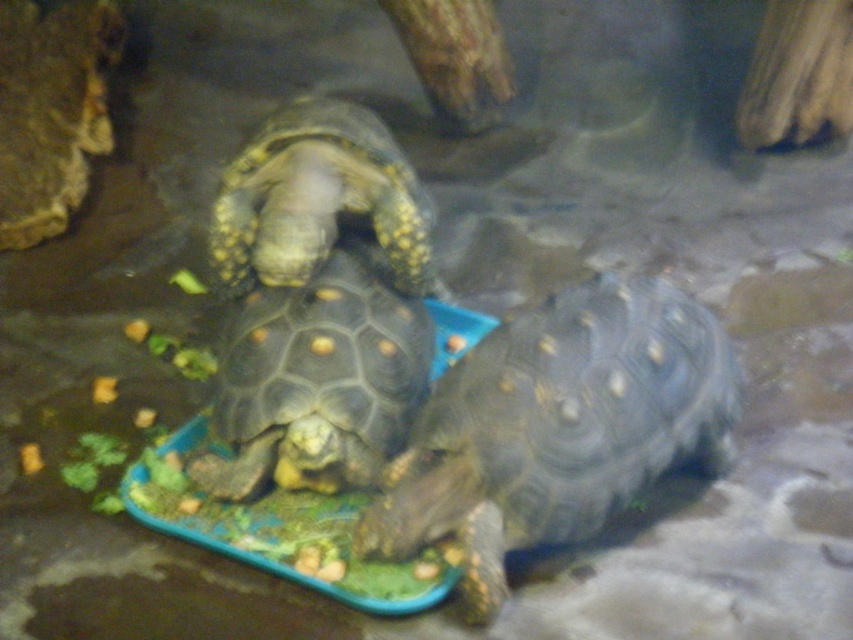
Question: Which is farther from the dark gray textured shell at center?

Choices:
 (A) yellowish matte tortoise at center
 (B) yellowish-brown scaly shell at center

Answer: (B)

Question: Where is dark gray textured shell at center located in relation to yellowish matte tortoise at center in the image?

Choices:
 (A) left
 (B) right

Answer: (B)

Question: Based on their relative distances, which object is farther from the dark gray textured shell at center?

Choices:
 (A) yellowish-brown scaly shell at center
 (B) yellowish matte tortoise at center

Answer: (A)

Question: Does dark gray textured shell at center appear over yellowish-brown scaly shell at center?

Choices:
 (A) yes
 (B) no

Answer: (B)

Question: Does dark gray textured shell at center appear over yellowish matte tortoise at center?

Choices:
 (A) yes
 (B) no

Answer: (B)

Question: Which of the following is the farthest from the observer?

Choices:
 (A) (341, 152)
 (B) (231, 364)

Answer: (A)